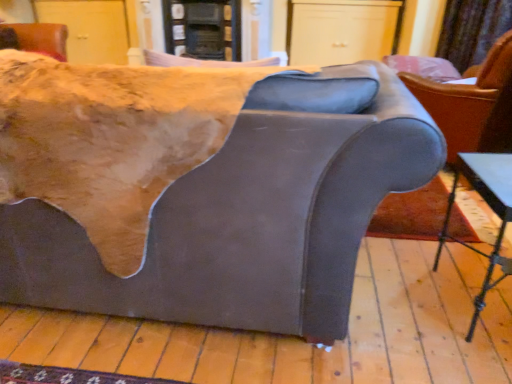
Find the location of a particular element. The width and height of the screenshot is (512, 384). free space behind metallic silver table at lower right is located at coordinates (437, 243).